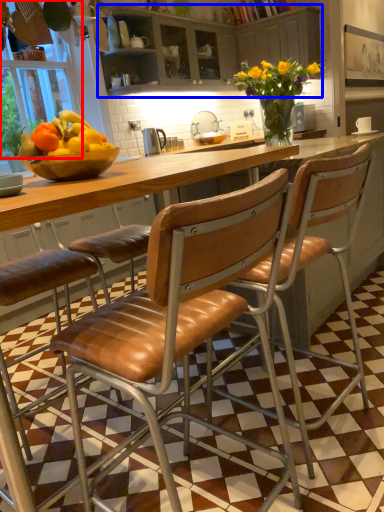
Question: Which object is closer to the camera taking this photo, window screen (highlighted by a red box) or cabinetry (highlighted by a blue box)?

Choices:
 (A) window screen
 (B) cabinetry

Answer: (A)